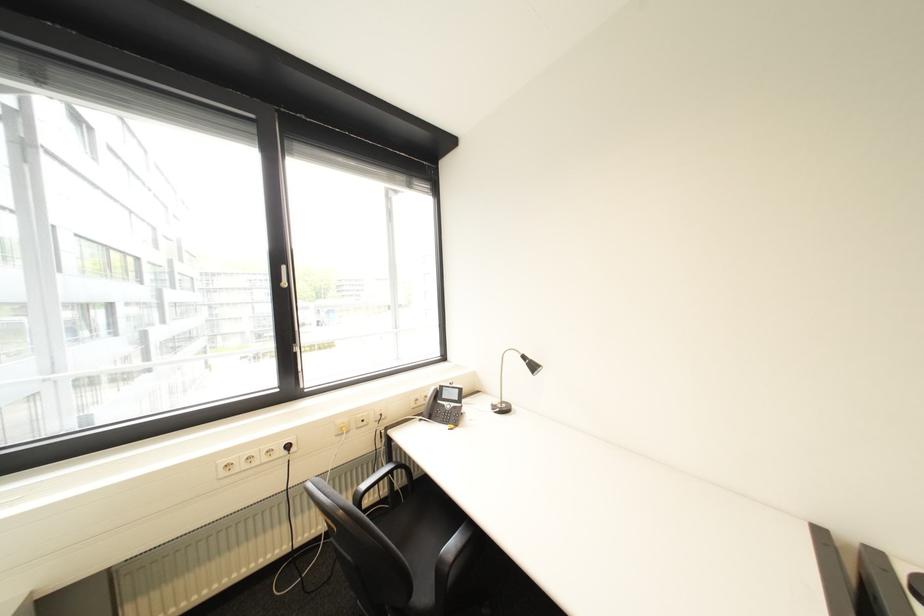
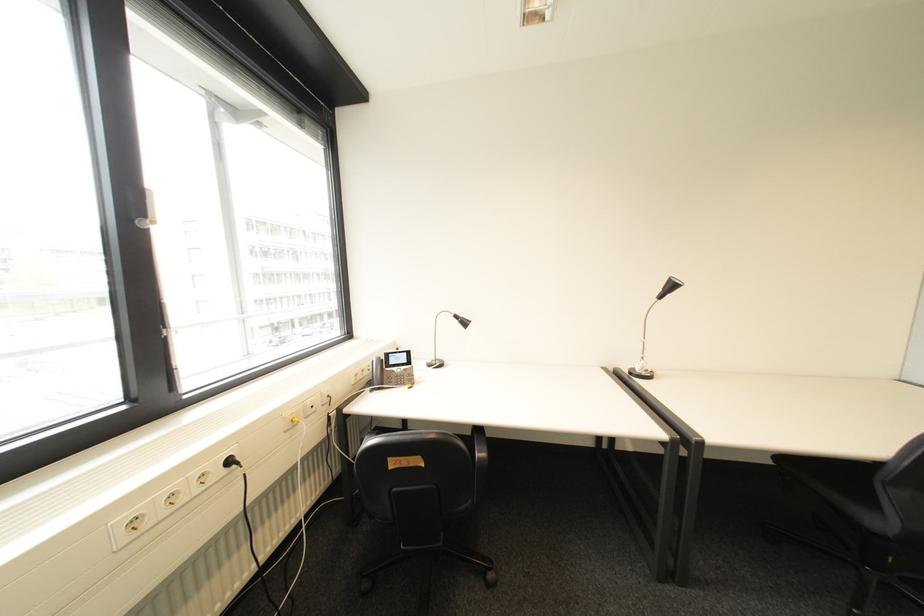
Question: The camera is either moving clockwise (left) or counter-clockwise (right) around the object. The first image is from the beginning of the video and the second image is from the end. Is the camera moving left or right when shooting the video?

Choices:
 (A) Left
 (B) Right

Answer: (A)